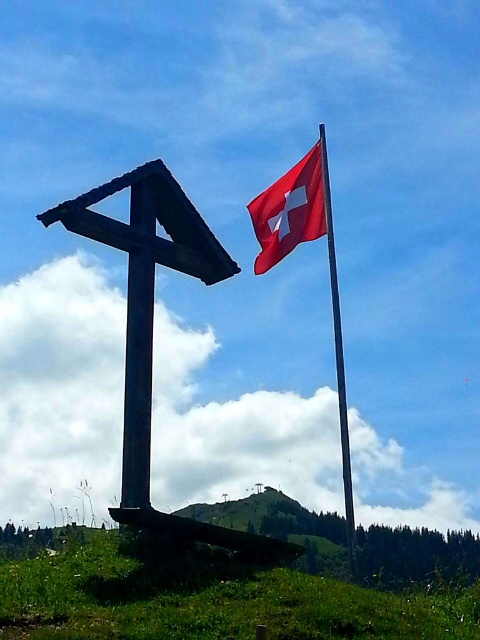
Does point (265, 256) lie behind point (324, 220)?

That is True.

In the scene shown: Which is above, red fabric flag at upper right or red fabric flag pole at upper center?

red fabric flag at upper right is higher up.

Does point (268, 237) lie in front of point (333, 308)?

That is True.

Image resolution: width=480 pixels, height=640 pixels. What are the coordinates of `red fabric flag at upper right` in the screenshot? It's located at (292, 209).

Which of these two, dark brown wooden cross at left or red fabric flag pole at upper center, stands taller?

With more height is red fabric flag pole at upper center.

Does dark brown wooden cross at left appear over red fabric flag pole at upper center?

Indeed, dark brown wooden cross at left is positioned over red fabric flag pole at upper center.

Who is more forward, (130, 362) or (348, 508)?

Positioned in front is point (130, 362).

The image size is (480, 640). I want to click on dark brown wooden cross at left, so click(144, 285).

Does green grassy hillside at lower center have a lesser height compared to red fabric flag pole at upper center?

Indeed, green grassy hillside at lower center has a lesser height compared to red fabric flag pole at upper center.

Image resolution: width=480 pixels, height=640 pixels. Find the location of `green grassy hillside at lower center`. green grassy hillside at lower center is located at coordinates (211, 600).

At what (x,y) coordinates should I click in order to perform the action: click on green grassy hillside at lower center. Please return your answer as a coordinate pair (x, y). Image resolution: width=480 pixels, height=640 pixels. Looking at the image, I should click on (211, 600).